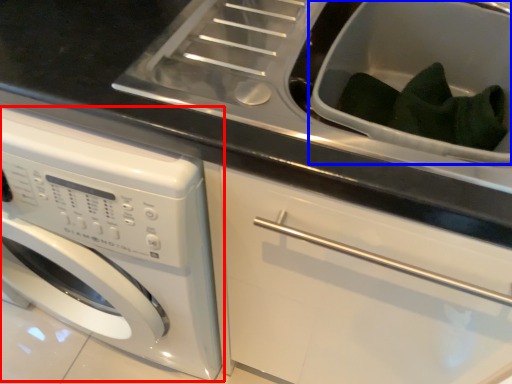
Question: Among these objects, which one is nearest to the camera, washing machine (highlighted by a red box) or sink (highlighted by a blue box)?

Choices:
 (A) washing machine
 (B) sink

Answer: (A)